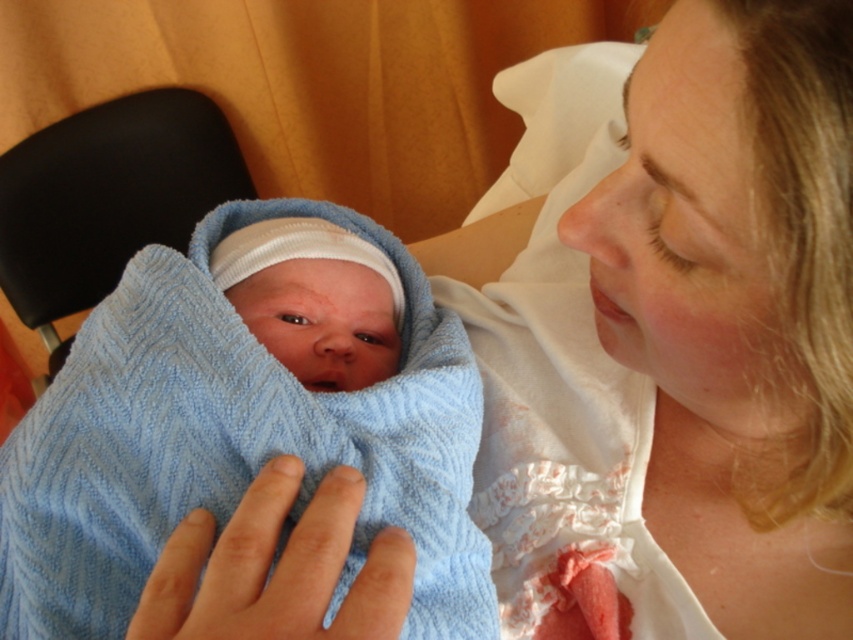
Question: Does white knit cap at center appear on the left side of light blue knitted blanket at center?

Choices:
 (A) yes
 (B) no

Answer: (B)

Question: Which of the following is the farthest from the observer?

Choices:
 (A) (248, 232)
 (B) (432, 348)

Answer: (A)

Question: Does white knit cap at center have a larger size compared to light blue knitted blanket at center?

Choices:
 (A) yes
 (B) no

Answer: (B)

Question: Which point is closer to the camera?

Choices:
 (A) (231, 280)
 (B) (418, 593)

Answer: (B)

Question: In this image, where is white knit cap at center located relative to light blue knitted blanket at center?

Choices:
 (A) above
 (B) below

Answer: (A)